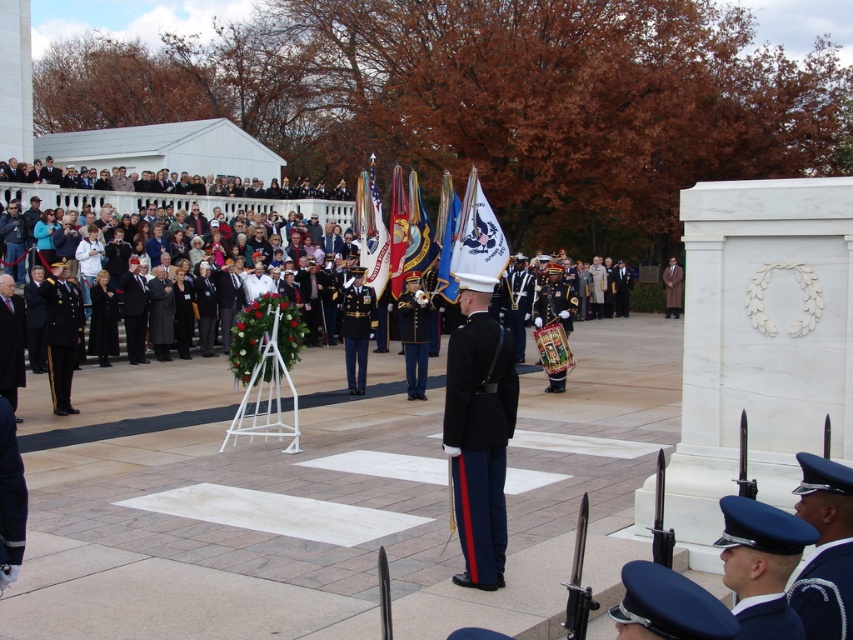
Is point (477, 577) more distant than point (346, 356)?

No, it is in front of (346, 356).

Who is lower down, dark blue fabric uniform at center or shiny dark blue uniform at center?

dark blue fabric uniform at center is lower down.

Image resolution: width=853 pixels, height=640 pixels. Find the location of `dark blue fabric uniform at center`. dark blue fabric uniform at center is located at coordinates (479, 442).

The height and width of the screenshot is (640, 853). Identify the location of dark blue fabric uniform at center. (479, 442).

The image size is (853, 640). Identify the location of blue uniform at right. (825, 548).

This screenshot has height=640, width=853. Describe the element at coordinates (825, 548) in the screenshot. I see `blue uniform at right` at that location.

In order to click on blue uniform at right in this screenshot , I will do `click(825, 548)`.

Can you confirm if blue uniform at right is positioned below shiny gold uniform at center?

Indeed, blue uniform at right is positioned under shiny gold uniform at center.

Measure the distance between point (848,608) and camera.

Point (848,608) and camera are 10.91 feet apart.

The width and height of the screenshot is (853, 640). In order to click on blue uniform at right in this screenshot , I will do `click(825, 548)`.